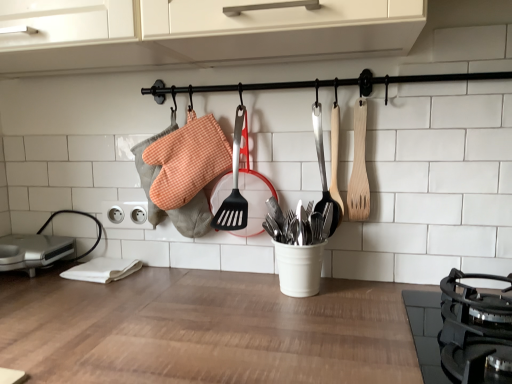
Question: Considering the relative sizes of silver metallic sandwich maker at lower left and wooden spatula at right, which appears as the 2th spatula when viewed from the left, in the image provided, is silver metallic sandwich maker at lower left bigger than wooden spatula at right, which appears as the 2th spatula when viewed from the left,?

Choices:
 (A) no
 (B) yes

Answer: (B)

Question: Is silver metallic sandwich maker at lower left further to camera compared to wooden spatula at right, the 1th spatula when ordered from right to left?

Choices:
 (A) no
 (B) yes

Answer: (B)

Question: Is silver metallic sandwich maker at lower left looking in the opposite direction of wooden spatula at right, which appears as the 2th spatula when viewed from the left?

Choices:
 (A) no
 (B) yes

Answer: (A)

Question: Would you say silver metallic sandwich maker at lower left contains wooden spatula at right, the 1th spatula when ordered from right to left?

Choices:
 (A) no
 (B) yes

Answer: (A)

Question: Is silver metallic sandwich maker at lower left thinner than wooden spatula at right, which appears as the 2th spatula when viewed from the left?

Choices:
 (A) yes
 (B) no

Answer: (B)

Question: From a real-world perspective, is wooden spatula at center, the 2th spatula viewed from the right, above or below black matte gas stove at lower right?

Choices:
 (A) below
 (B) above

Answer: (B)

Question: Is wooden spatula at center, the 2th spatula viewed from the right, bigger or smaller than black matte gas stove at lower right?

Choices:
 (A) big
 (B) small

Answer: (B)

Question: Considering their positions, is wooden spatula at center, which appears as the first spatula when viewed from the left, located in front of or behind black matte gas stove at lower right?

Choices:
 (A) front
 (B) behind

Answer: (B)

Question: Is wooden spatula at center, the 2th spatula viewed from the right, spatially inside black matte gas stove at lower right, or outside of it?

Choices:
 (A) outside
 (B) inside

Answer: (A)

Question: In terms of size, does silver metallic sandwich maker at lower left appear bigger or smaller than wooden spatula at right, which appears as the 2th spatula when viewed from the left?

Choices:
 (A) big
 (B) small

Answer: (A)

Question: Is silver metallic sandwich maker at lower left in front of or behind wooden spatula at right, the 1th spatula when ordered from right to left, in the image?

Choices:
 (A) behind
 (B) front

Answer: (A)

Question: Considering the relative positions of silver metallic sandwich maker at lower left and wooden spatula at right, the 1th spatula when ordered from right to left, in the image provided, is silver metallic sandwich maker at lower left to the left or to the right of wooden spatula at right, the 1th spatula when ordered from right to left,?

Choices:
 (A) right
 (B) left

Answer: (B)

Question: In terms of width, does silver metallic sandwich maker at lower left look wider or thinner when compared to wooden spatula at right, which appears as the 2th spatula when viewed from the left?

Choices:
 (A) wide
 (B) thin

Answer: (A)

Question: From a real-world perspective, is wooden spatula at right, which appears as the 2th spatula when viewed from the left, positioned above or below wooden spatula at center, which appears as the first spatula when viewed from the left?

Choices:
 (A) above
 (B) below

Answer: (A)

Question: Considering the positions of wooden spatula at right, the 1th spatula when ordered from right to left, and wooden spatula at center, the 2th spatula viewed from the right, in the image, is wooden spatula at right, the 1th spatula when ordered from right to left, wider or thinner than wooden spatula at center, the 2th spatula viewed from the right,?

Choices:
 (A) thin
 (B) wide

Answer: (B)